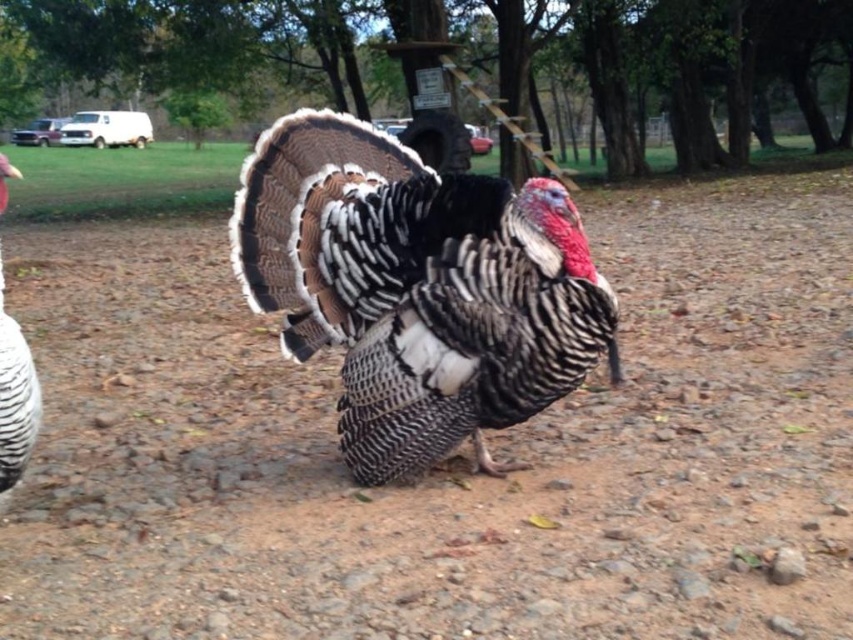
Question: Does brown textured dirt at center appear over white feathered turkey at left?

Choices:
 (A) yes
 (B) no

Answer: (B)

Question: Among these points, which one is nearest to the camera?

Choices:
 (A) (294, 230)
 (B) (15, 337)
 (C) (807, 529)

Answer: (B)

Question: Does brown textured dirt at center have a smaller size compared to white feathered turkey at left?

Choices:
 (A) no
 (B) yes

Answer: (B)

Question: Which point appears farthest from the camera in this image?

Choices:
 (A) (265, 260)
 (B) (166, 380)

Answer: (B)

Question: Which of the following is the farthest from the observer?

Choices:
 (A) (9, 333)
 (B) (637, 630)
 (C) (564, 333)

Answer: (C)

Question: Does brown textured dirt at center appear under speckled feathered turkey at center?

Choices:
 (A) yes
 (B) no

Answer: (A)